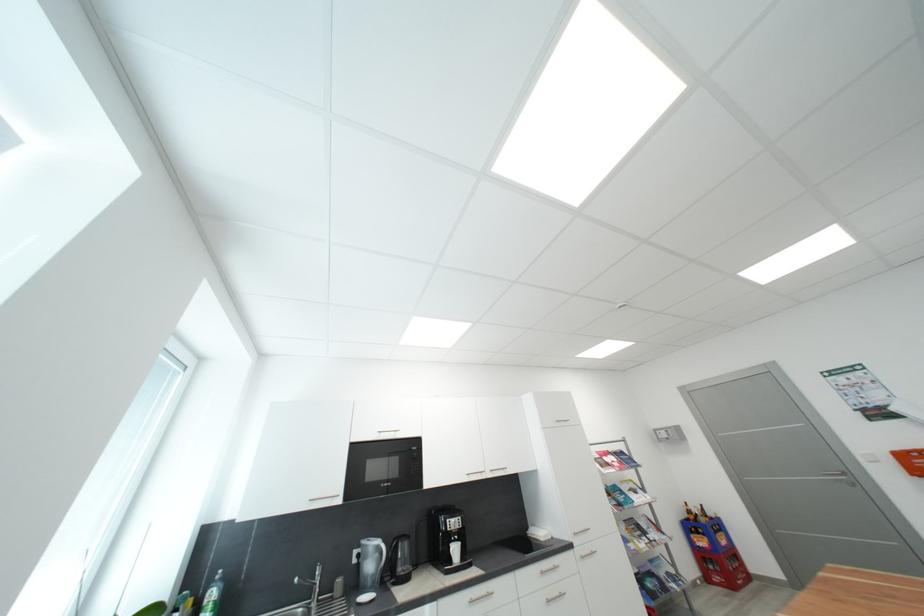
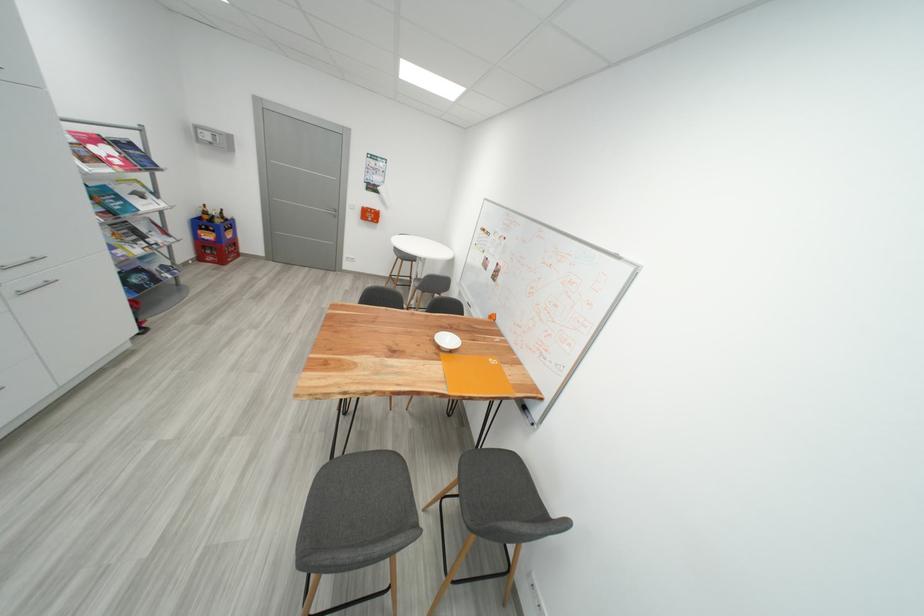
First-person continuous shooting, in which direction is the camera rotating?

The camera rotated toward right-down.